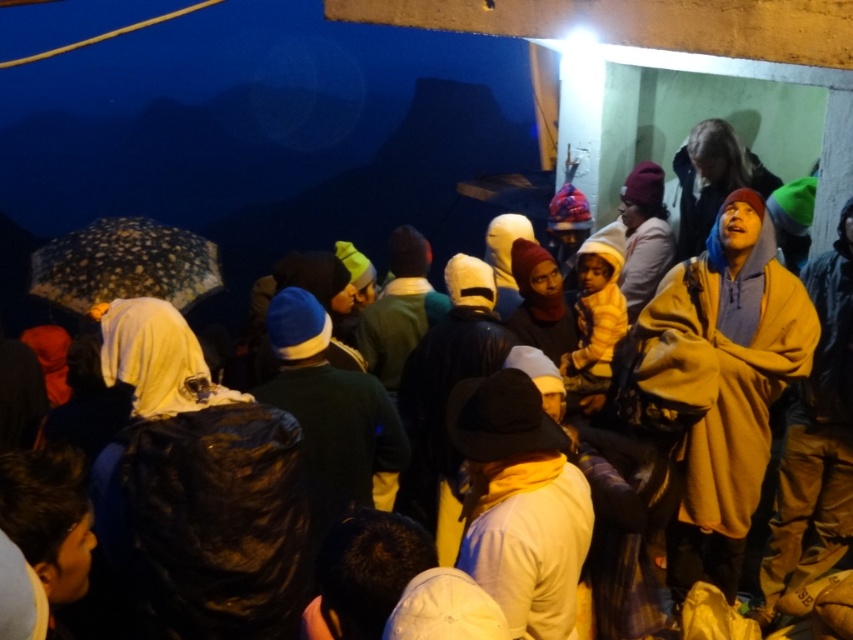
Question: From the image, what is the correct spatial relationship of brown fleece jacket at right in relation to speckled fabric umbrella at left?

Choices:
 (A) above
 (B) below

Answer: (B)

Question: Can you confirm if brown fleece jacket at right is smaller than speckled fabric umbrella at left?

Choices:
 (A) yes
 (B) no

Answer: (A)

Question: Which point is farther to the camera?

Choices:
 (A) brown fleece jacket at right
 (B) speckled fabric umbrella at left

Answer: (B)

Question: Can you confirm if brown fleece jacket at right is wider than speckled fabric umbrella at left?

Choices:
 (A) no
 (B) yes

Answer: (A)

Question: Which of the following is the farthest from the observer?

Choices:
 (A) (651, 305)
 (B) (102, 269)

Answer: (B)